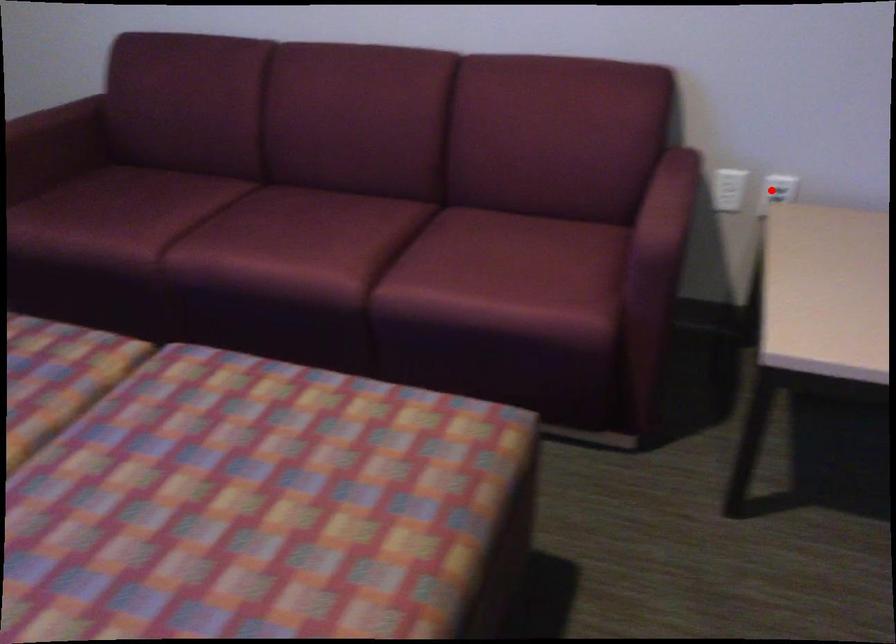
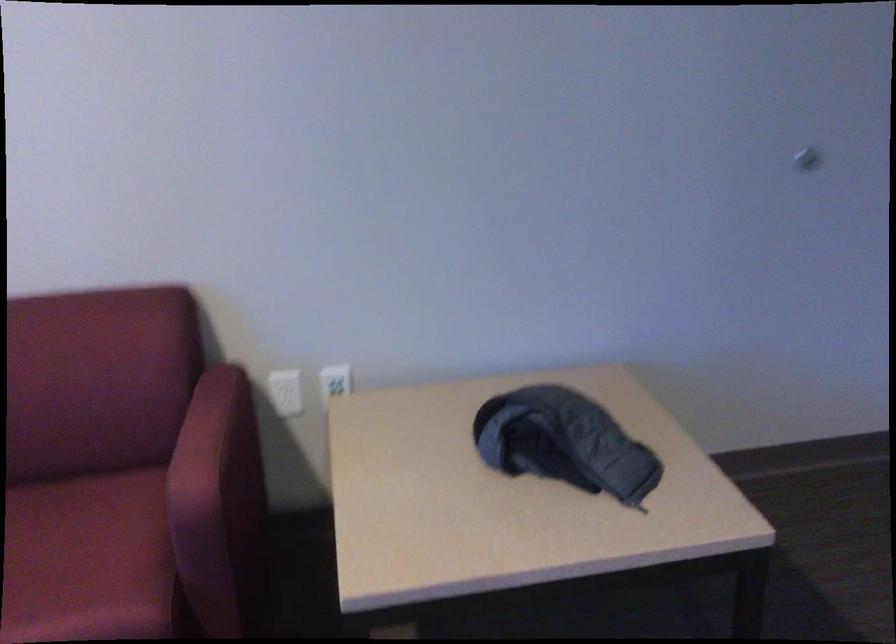
The point at the highlighted location is marked in the first image. Where is the corresponding point in the second image?

(334, 382)